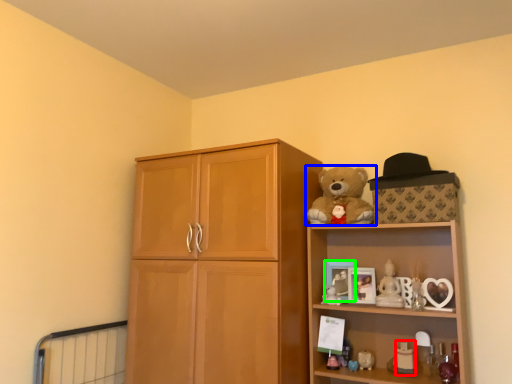
Question: Based on their relative distances, which object is farther from toy (highlighted by a red box)? Choose from teddy bear (highlighted by a blue box) and picture frame (highlighted by a green box).

Choices:
 (A) teddy bear
 (B) picture frame

Answer: (A)